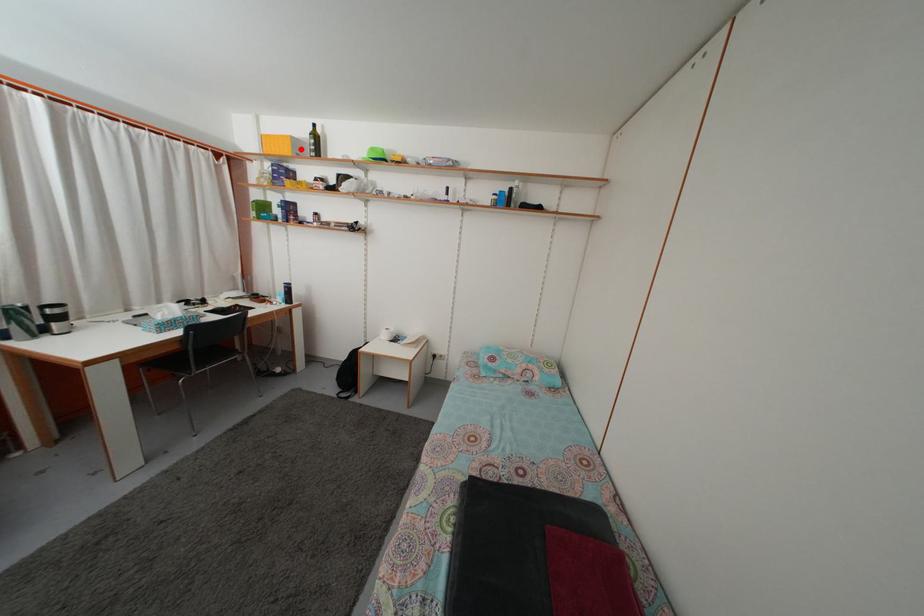
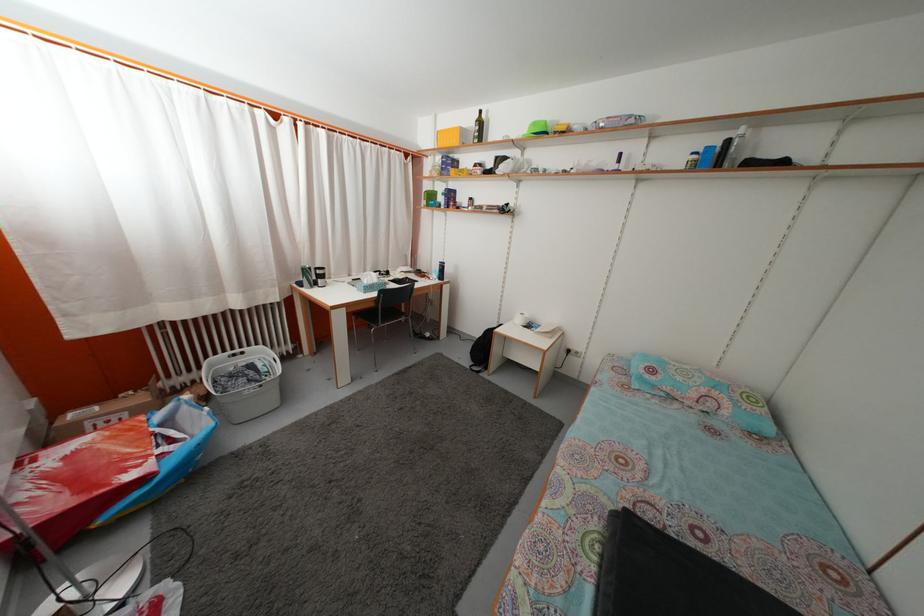
In the second image, find the point that corresponds to the highlighted location in the first image.

(468, 139)